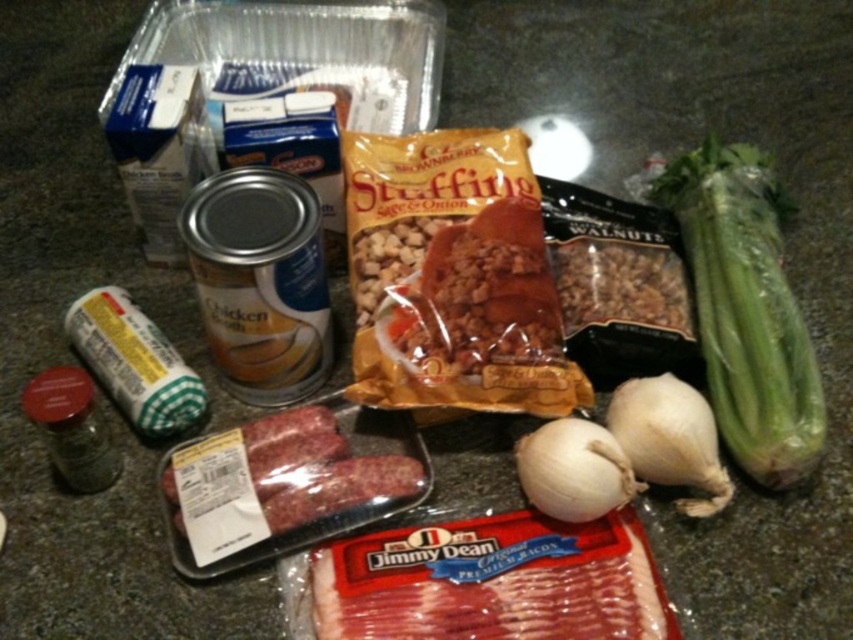
Question: Does brown crumbly stuffing at center have a larger size compared to white matte garlic at center?

Choices:
 (A) no
 (B) yes

Answer: (B)

Question: Which point is farther to the camera?

Choices:
 (A) (431, 342)
 (B) (553, 436)
 (C) (753, 428)

Answer: (C)

Question: Which of the following is the farthest from the observer?

Choices:
 (A) brown crumbly stuffing at center
 (B) white matte garlic at center

Answer: (A)

Question: Which point appears closest to the camera in this image?

Choices:
 (A) (753, 461)
 (B) (614, 467)
 (C) (412, 360)
 (D) (666, 417)

Answer: (B)

Question: Is green leafy celery at right positioned in front of white matte garlic at lower right?

Choices:
 (A) yes
 (B) no

Answer: (B)

Question: Is brown crumbly stuffing at center wider than white matte garlic at center?

Choices:
 (A) yes
 (B) no

Answer: (A)